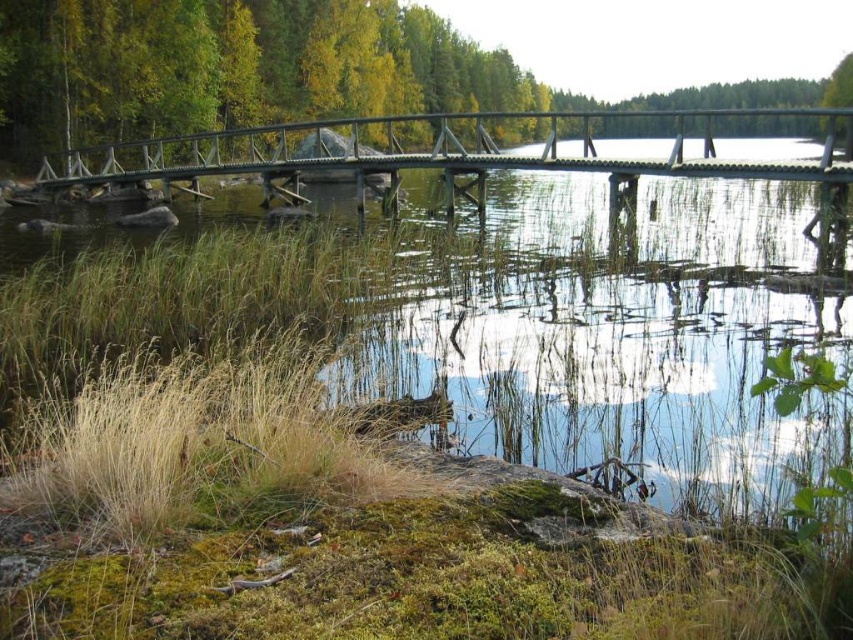
You are standing on the wooden bridge at center and want to take a photo of the green matte tree at upper center. In which direction should you point your camera to capture the tree in the frame?

The green matte tree at upper center is positioned on the left side of the wooden bridge at center, so you should point your camera to the left to capture the tree in the frame.